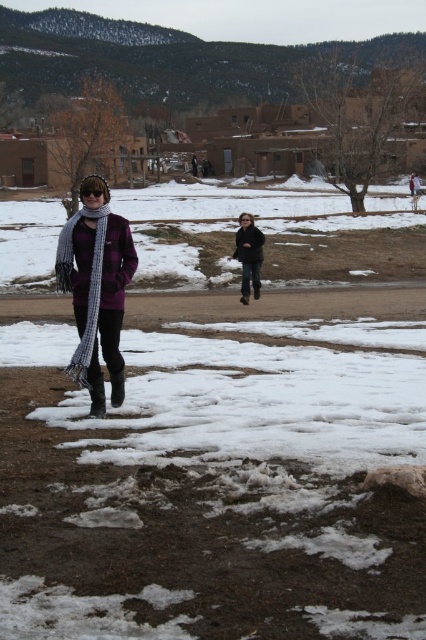
Question: Is plaid wool scarf at left closer to the viewer compared to dark gray jacket at center?

Choices:
 (A) no
 (B) yes

Answer: (B)

Question: Does plaid wool scarf at left come in front of dark gray jacket at center?

Choices:
 (A) no
 (B) yes

Answer: (B)

Question: Which point is closer to the camera?

Choices:
 (A) plaid wool scarf at left
 (B) dark gray jacket at center

Answer: (A)

Question: Is plaid wool scarf at left to the left of dark gray jacket at center from the viewer's perspective?

Choices:
 (A) yes
 (B) no

Answer: (A)

Question: Which point is farther to the camera?

Choices:
 (A) (97, 317)
 (B) (249, 227)

Answer: (B)